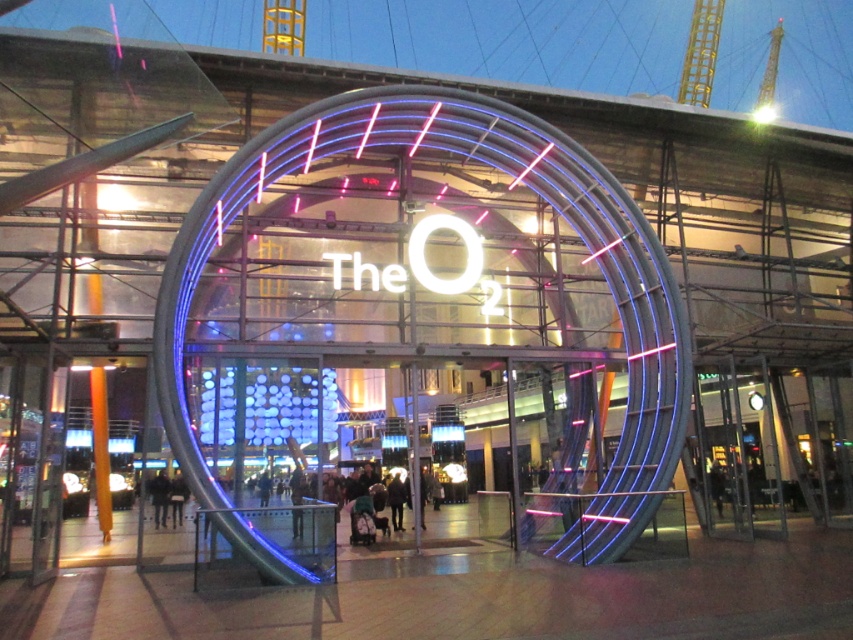
Question: Can you confirm if neon blue glass at center is smaller than dark brown leather coat at center?

Choices:
 (A) no
 (B) yes

Answer: (A)

Question: Which point is farther from the camera taking this photo?

Choices:
 (A) (387, 490)
 (B) (657, 243)

Answer: (A)

Question: Which point is farther from the camera taking this photo?

Choices:
 (A) (426, 484)
 (B) (602, 253)

Answer: (A)

Question: Can you confirm if neon blue glass at center is positioned to the right of dark brown leather coat at center?

Choices:
 (A) yes
 (B) no

Answer: (A)

Question: Is neon blue glass at center in front of dark brown leather coat at center?

Choices:
 (A) no
 (B) yes

Answer: (B)

Question: Which point is farther to the camera?

Choices:
 (A) (683, 372)
 (B) (352, 467)

Answer: (B)